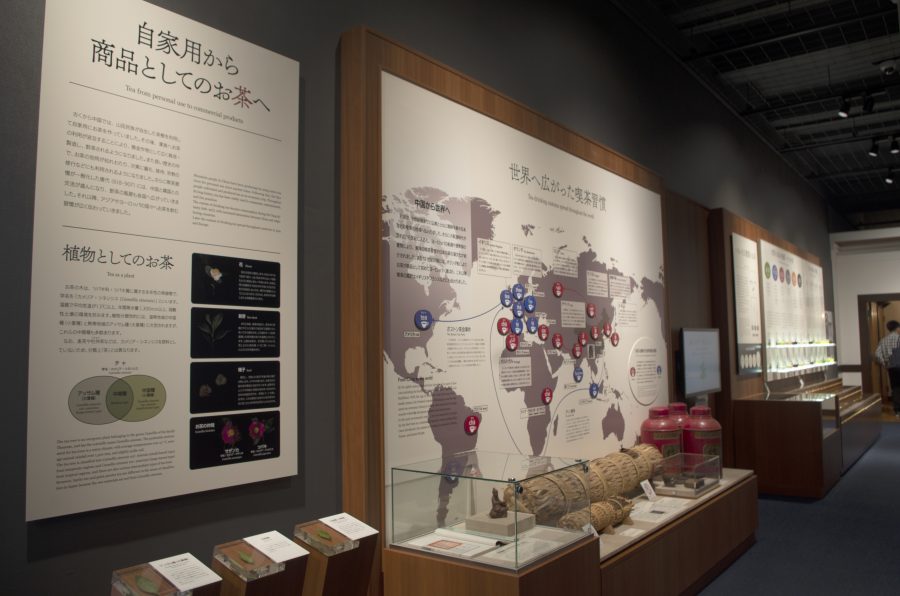
Identify the location of display case. This screenshot has height=596, width=900. (555, 533), (846, 394), (824, 400), (456, 495), (487, 468).